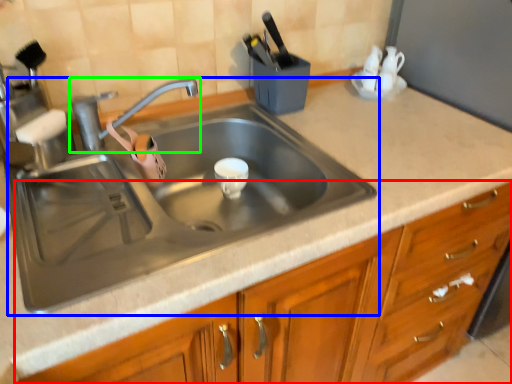
Question: Estimate the real-world distances between objects in this image. Which object is farther from cabinetry (highlighted by a red box), sink (highlighted by a blue box) or tap (highlighted by a green box)?

Choices:
 (A) sink
 (B) tap

Answer: (B)